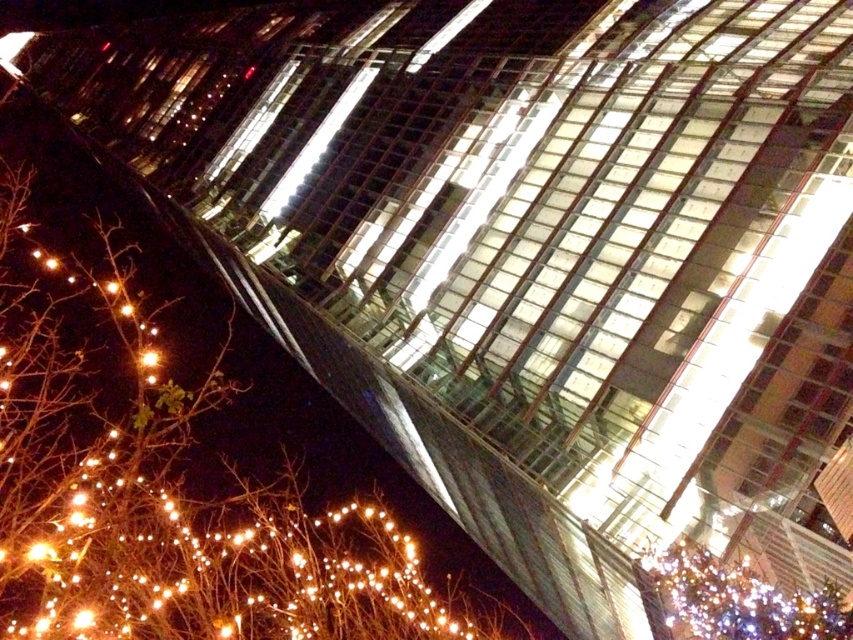
You are standing in the park at night looking at the skyscraper. You notice two points of light in the scene. One is labeled as point (50, 620) and the other is point (763, 605). Which point is closer to you?

Point (763, 605) is closer to you because it is in front of point (50, 620).

You are standing in the park at night and see the shiny gold lights at lower left and the illuminated glass tree at lower right. Which object is located to the left of the other?

The shiny gold lights at lower left is positioned on the left side of the illuminated glass tree at lower right.

You are a photographer trying to capture the skyscraper at night. You notice the shiny gold lights at lower left and the illuminated glass tree at lower right. Which object should you focus on first to ensure both are in the frame without moving the camera?

You should focus on the illuminated glass tree at lower right first because it is behind the shiny gold lights at lower left, so adjusting focus on the farther object will help keep both in the frame.